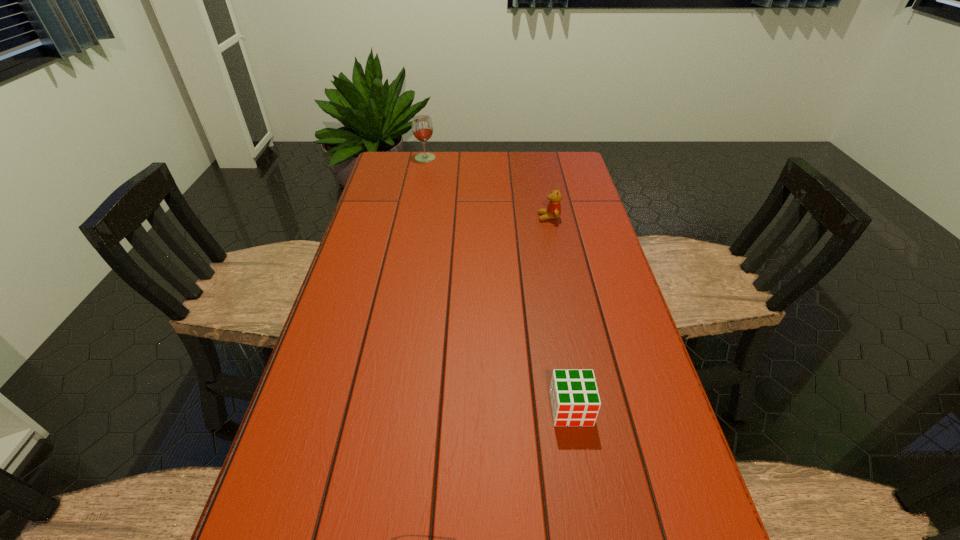
Identify the location of vacant area at the far right corner. click(x=553, y=161).

I want to click on free space between the wineglass and the cube, so click(x=498, y=284).

Where is `free space between the farthest object and the shortest object`? free space between the farthest object and the shortest object is located at coordinates (498, 284).

Locate an element on the screen. The image size is (960, 540). the closest object to the teddy bear is located at coordinates (422, 128).

Locate which object ranks second in proximity to the second shortest object. Please provide its 2D coordinates. Your answer should be formatted as a tuple, i.e. [(x, y)], where the tuple contains the x and y coordinates of a point satisfying the conditions above.

[(575, 401)]

What are the coordinates of `free spot that satisfies the following two spatial constraints: 1. on the front-facing side of the second tallest object; 2. on the red face of the cube` in the screenshot? It's located at (588, 409).

The width and height of the screenshot is (960, 540). I want to click on vacant space that satisfies the following two spatial constraints: 1. on the front-facing side of the second shortest object; 2. on the red face of the shortest object, so click(x=588, y=409).

The image size is (960, 540). What are the coordinates of `vacant area in the image that satisfies the following two spatial constraints: 1. on the front-facing side of the teddy bear; 2. on the red face of the nearest object` in the screenshot? It's located at (588, 409).